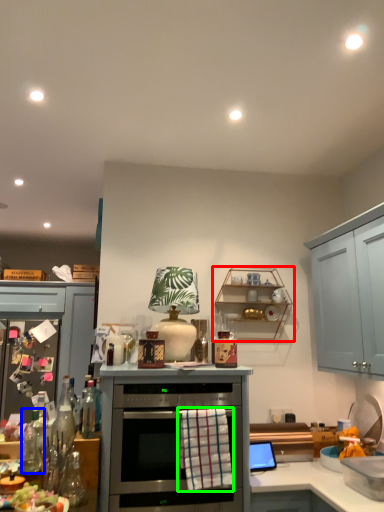
Question: Considering the real-world distances, which object is farthest from shelf (highlighted by a red box)? bottle (highlighted by a blue box) or material (highlighted by a green box)?

Choices:
 (A) bottle
 (B) material

Answer: (A)